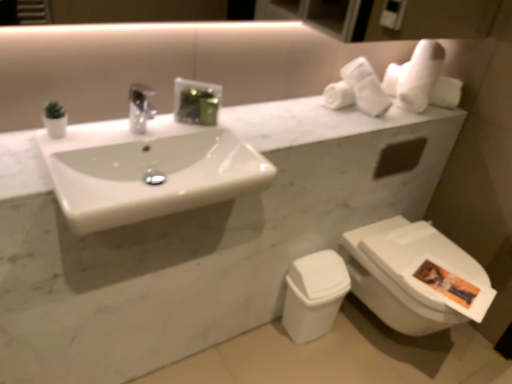
At what (x,y) coordinates should I click in order to perform the action: click on free space between white glossy toilet at lower right and white plastic toilet bowl at lower right. Please return your answer as a coordinate pair (x, y). Looking at the image, I should click on (342, 357).